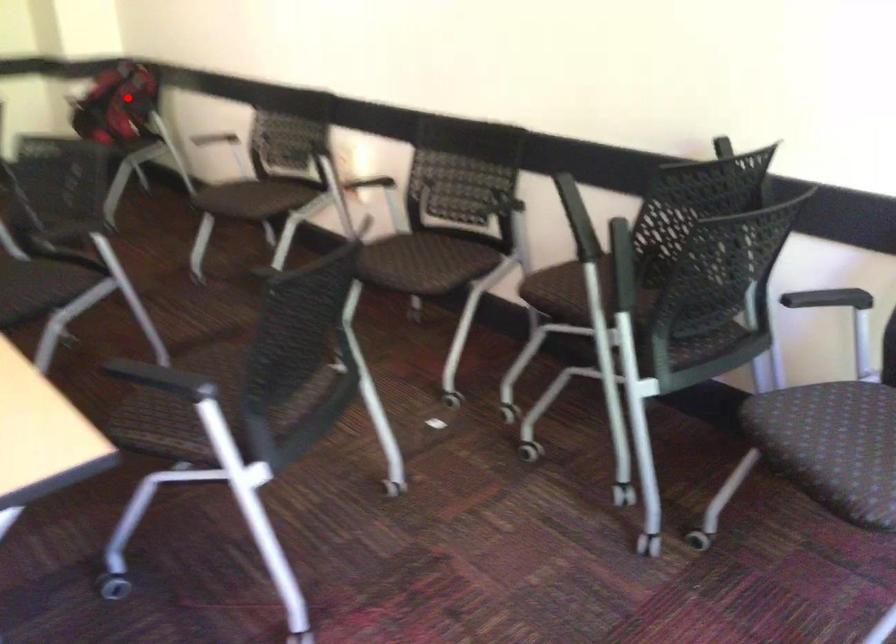
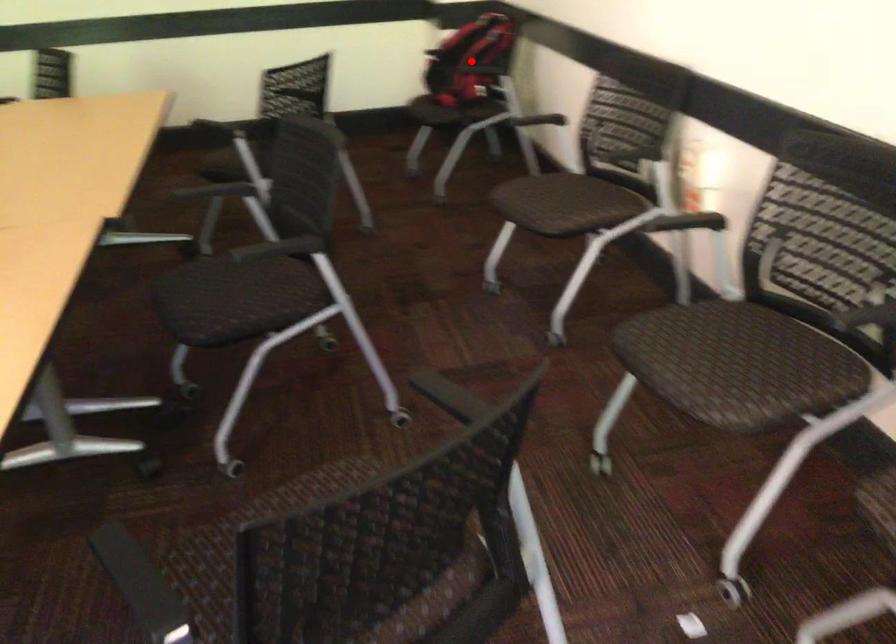
I am providing you with two images of the same scene from different viewpoints. A red point is marked on the first image and another point is marked on the second image. Is the marked point in image1 the same physical position as the marked point in image2?

Yes